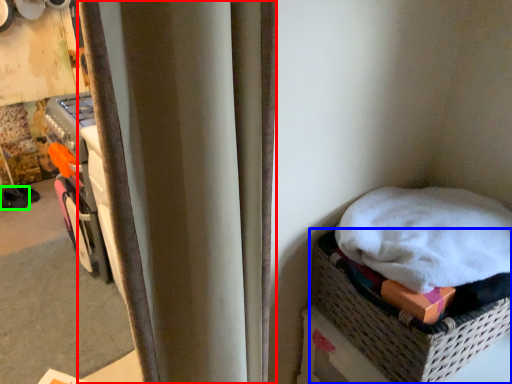
Question: Considering the real-world distances, which object is farthest from curtain (highlighted by a red box)? basket (highlighted by a blue box) or footwear (highlighted by a green box)?

Choices:
 (A) basket
 (B) footwear

Answer: (B)